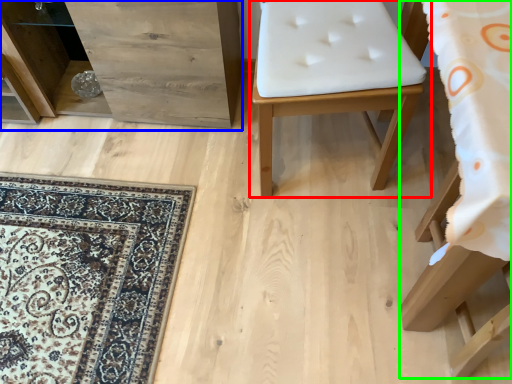
Question: Estimate the real-world distances between objects in this image. Which object is farther from furniture (highlighted by a red box), dresser (highlighted by a blue box) or furniture (highlighted by a green box)?

Choices:
 (A) dresser
 (B) furniture

Answer: (A)